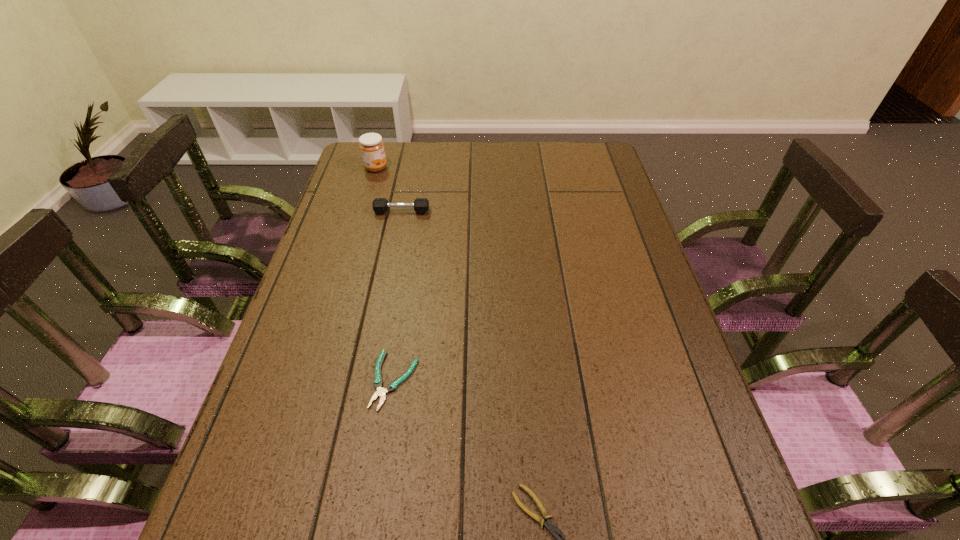
Identify the location of jam. (371, 146).

You are a GUI agent. You are given a task and a screenshot of the screen. Output one action in this format:
    pyautogui.click(x=<x>, y=<y>)
    Task: Click on the tallest object
    This screenshot has height=540, width=960.
    Given the screenshot: What is the action you would take?
    pyautogui.click(x=371, y=146)

I want to click on the third shortest object, so click(x=380, y=205).

Where is `the second farthest object`? the second farthest object is located at coordinates (380, 205).

Locate an element on the screen. This screenshot has width=960, height=540. the left pliers is located at coordinates (381, 392).

Where is `the farther pliers`? This screenshot has height=540, width=960. the farther pliers is located at coordinates (381, 392).

Image resolution: width=960 pixels, height=540 pixels. Find the location of `free space located on the front label of the tallest object`. free space located on the front label of the tallest object is located at coordinates (421, 168).

At what (x,y) coordinates should I click in order to perform the action: click on free space located on the back of the second farthest object. Please return your answer as a coordinate pair (x, y). Looking at the image, I should click on (409, 177).

The image size is (960, 540). Find the location of `vacant point located 0.150m on the right of the left pliers`. vacant point located 0.150m on the right of the left pliers is located at coordinates (486, 380).

Find the location of `object present at the far edge`. object present at the far edge is located at coordinates click(x=371, y=146).